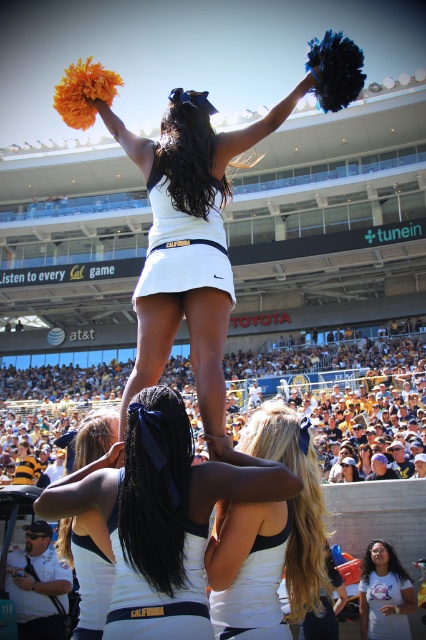
Can you confirm if white matte cheerleader at center is positioned below white matte t-shirt at lower right?

Incorrect, white matte cheerleader at center is not positioned below white matte t-shirt at lower right.

Does point (106, 609) come closer to viewer compared to point (377, 634)?

Yes, it is.

This screenshot has width=426, height=640. Find the location of `white matte cheerleader at center`. white matte cheerleader at center is located at coordinates (89, 568).

Does white plastic cups at center have a greater width compared to white matte t-shirt at lower right?

Correct, the width of white plastic cups at center exceeds that of white matte t-shirt at lower right.

Which is behind, point (342, 436) or point (368, 636)?

Point (342, 436)

Is point (32, 355) positioned in front of point (365, 634)?

No.

Image resolution: width=426 pixels, height=640 pixels. In order to click on white plastic cups at center in this screenshot , I will do `click(342, 384)`.

Is white matte uniform at center above white matte tank top at center?

Yes, white matte uniform at center is above white matte tank top at center.

What are the coordinates of `white matte uniform at center` in the screenshot? It's located at pyautogui.click(x=163, y=515).